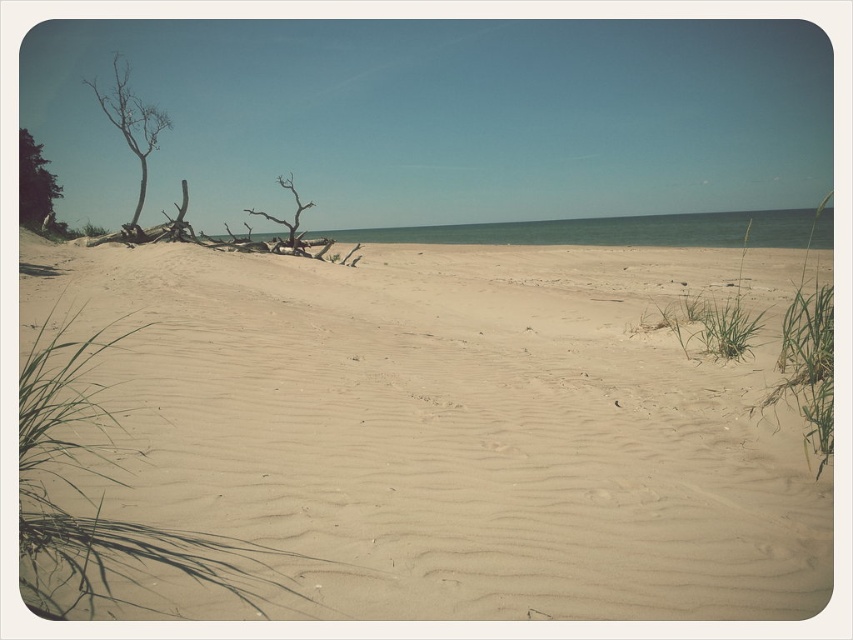
Who is positioned more to the left, smooth sand at center or bare wood tree at left?

From the viewer's perspective, bare wood tree at left appears more on the left side.

Is point (428, 616) farther from camera compared to point (119, 122)?

No, (428, 616) is in front of (119, 122).

Locate an element on the screen. Image resolution: width=853 pixels, height=640 pixels. smooth sand at center is located at coordinates (456, 429).

What do you see at coordinates (35, 184) in the screenshot? I see `green leafy tree at left` at bounding box center [35, 184].

Between green leafy tree at left and brown driftwood at center, which one has more height?

brown driftwood at center

Where is `green leafy tree at left`? The image size is (853, 640). green leafy tree at left is located at coordinates (35, 184).

You are a GUI agent. You are given a task and a screenshot of the screen. Output one action in this format:
    pyautogui.click(x=<x>, y=<y>)
    Task: Click on the green leafy tree at left
    This screenshot has height=640, width=853.
    Given the screenshot: What is the action you would take?
    pyautogui.click(x=35, y=184)

Is point (135, 147) positioned before point (24, 140)?

Yes, it is in front of point (24, 140).

Between point (125, 65) and point (33, 224), which one is positioned behind?

Point (125, 65)

Is point (113, 54) more distant than point (36, 160)?

Yes, it is behind point (36, 160).

Where is `bare wood tree at left`? bare wood tree at left is located at coordinates (131, 122).